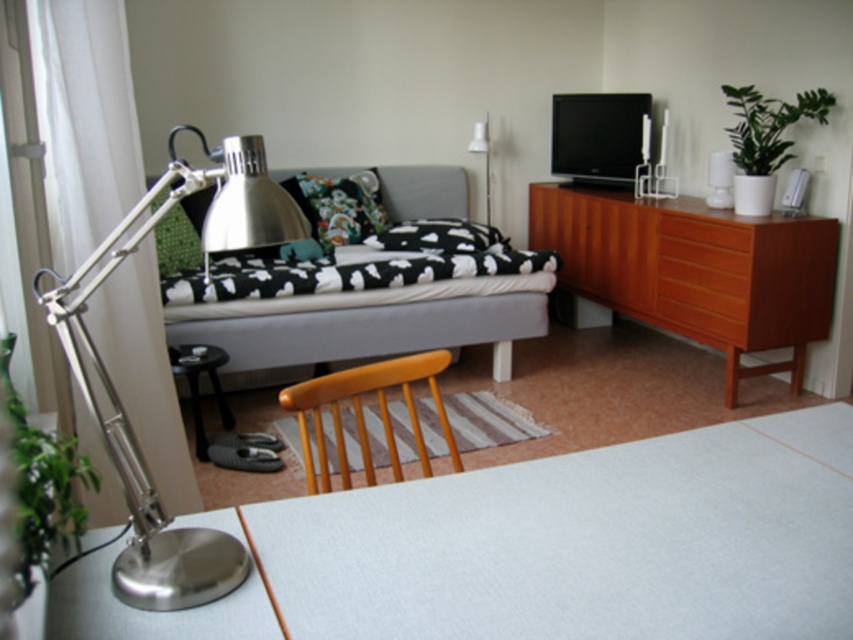
Can you confirm if silver/metallic desk lamp at left is thinner than black glossy table at lower left?

In fact, silver/metallic desk lamp at left might be wider than black glossy table at lower left.

Consider the image. Who is shorter, silver/metallic desk lamp at left or black glossy table at lower left?

With less height is black glossy table at lower left.

Does point (198, 182) lie behind point (213, 362)?

No, it is in front of (213, 362).

This screenshot has width=853, height=640. In order to click on silver/metallic desk lamp at left in this screenshot , I will do `click(115, 388)`.

Is teak wood dresser at right bigger than wooden drawer at right?

Indeed, teak wood dresser at right has a larger size compared to wooden drawer at right.

Who is higher up, teak wood dresser at right or wooden drawer at right?

teak wood dresser at right is above.

This screenshot has height=640, width=853. Find the location of `teak wood dresser at right`. teak wood dresser at right is located at coordinates (695, 269).

Where is `white matte table at lower center`? The height and width of the screenshot is (640, 853). white matte table at lower center is located at coordinates (540, 548).

Is white matte table at lower center smaller than black glossy table at lower left?

Actually, white matte table at lower center might be larger than black glossy table at lower left.

Where is `white matte table at lower center`? The height and width of the screenshot is (640, 853). white matte table at lower center is located at coordinates (540, 548).

The height and width of the screenshot is (640, 853). In order to click on white matte table at lower center in this screenshot , I will do `click(540, 548)`.